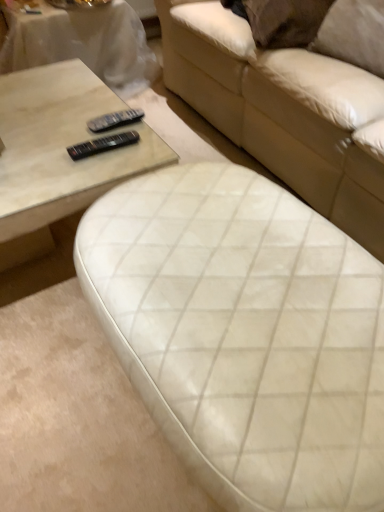
I want to click on free space to the left of black plastic remote at upper center, acting as the 1th remote starting from the top, so click(61, 134).